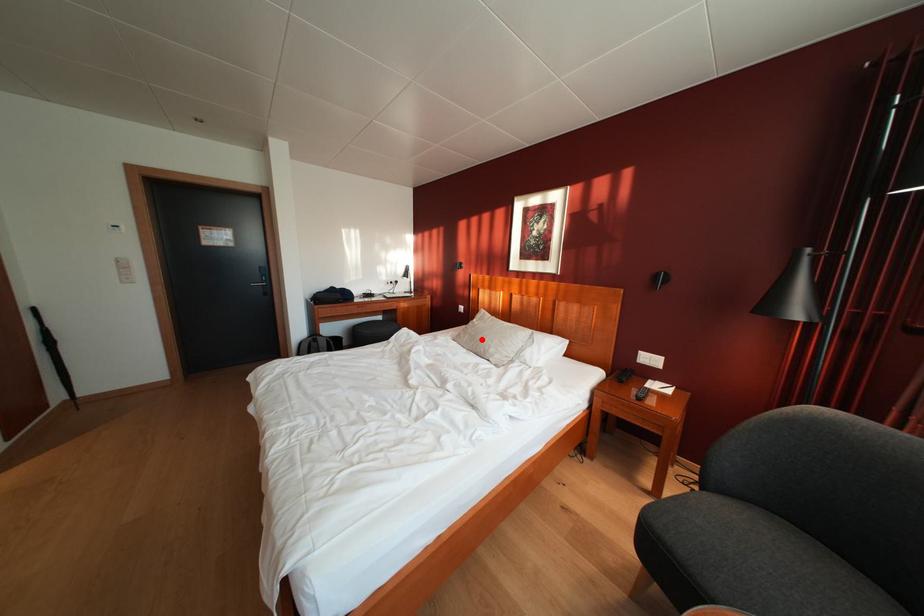
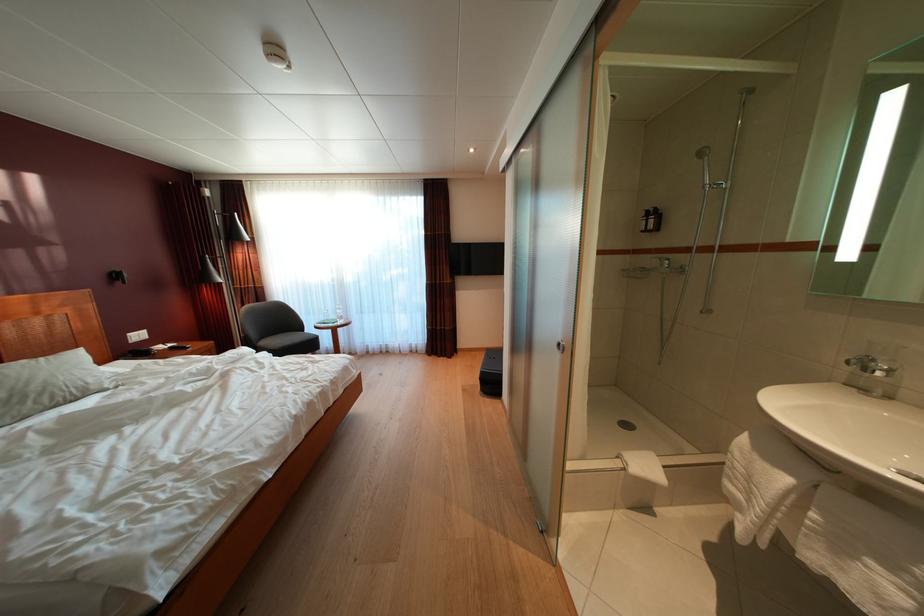
Question: I am providing you with two images of the same scene from different viewpoints. A red point is marked on the first image. At the location where the point appears in image 1, is it still visible in image 2?

Choices:
 (A) Yes
 (B) No

Answer: (A)